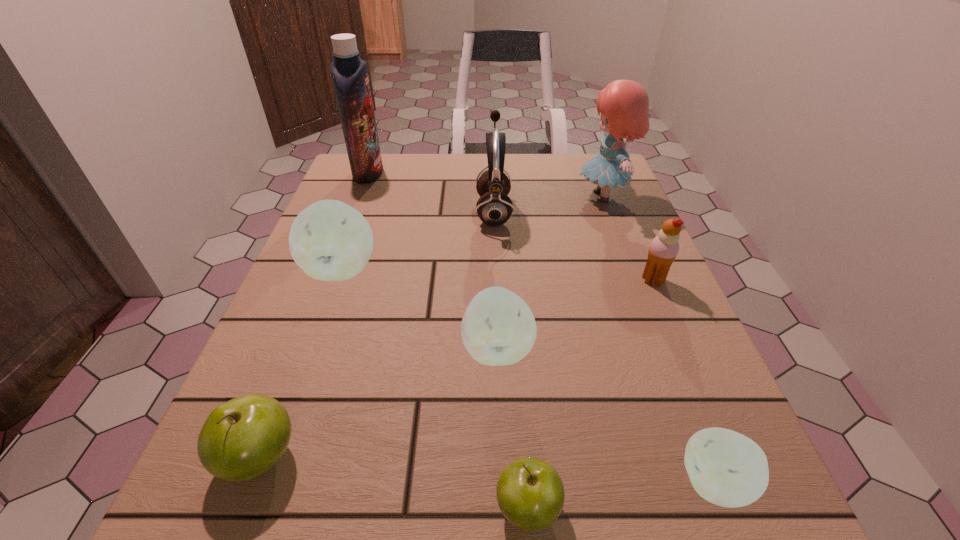
This screenshot has width=960, height=540. I want to click on vacant space located 0.190m on the ear pads of the brown earphone, so click(396, 211).

Locate an element on the screen. vacant space situated 0.170m at the front with a straw on the icecream is located at coordinates (554, 280).

The height and width of the screenshot is (540, 960). Find the location of `free space located 0.210m at the front with a straw on the icecream`. free space located 0.210m at the front with a straw on the icecream is located at coordinates (533, 280).

Find the location of `vacant region located at the front with a straw on the icecream`. vacant region located at the front with a straw on the icecream is located at coordinates coord(517,280).

At what (x,y) coordinates should I click in order to perform the action: click on vacant space situated 0.370m on the right of the farthest apple. Please return your answer as a coordinate pair (x, y). Looking at the image, I should click on tap(563, 269).

Identify the location of free space located on the right of the second white apple from left to right. (683, 349).

Where is `vacant area situated 0.090m on the back of the left green apple`? Image resolution: width=960 pixels, height=540 pixels. vacant area situated 0.090m on the back of the left green apple is located at coordinates (294, 369).

Where is `vacant space located 0.390m on the back of the nearest white apple`? vacant space located 0.390m on the back of the nearest white apple is located at coordinates (630, 266).

You are a GUI agent. You are given a task and a screenshot of the screen. Output one action in this format:
    pyautogui.click(x=<x>, y=<y>)
    Task: Click on the shampoo that is at the far edge
    The height and width of the screenshot is (540, 960).
    Given the screenshot: What is the action you would take?
    pyautogui.click(x=349, y=72)

Locate an element on the screen. doll located in the far edge section of the desktop is located at coordinates 624,104.